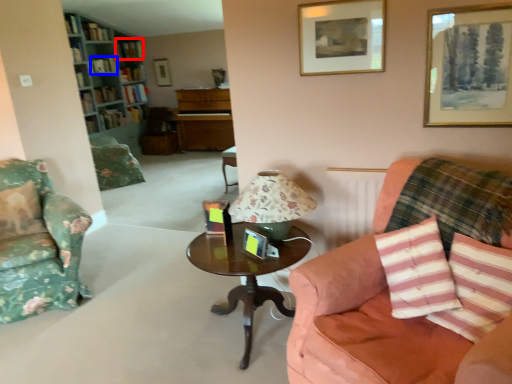
Question: Which object is further to the camera taking this photo, book (highlighted by a red box) or book (highlighted by a blue box)?

Choices:
 (A) book
 (B) book

Answer: (A)